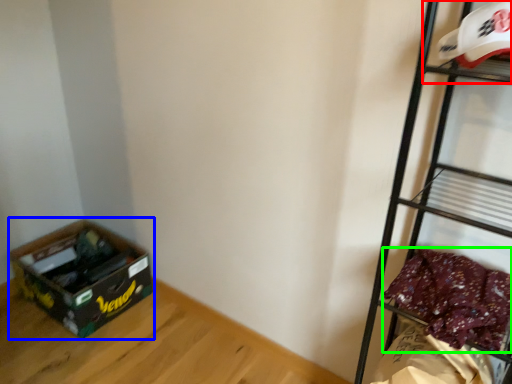
Question: Which object is the closest to the shelf (highlighted by a red box)? Choose among these: storage box (highlighted by a blue box) or clothing (highlighted by a green box).

Choices:
 (A) storage box
 (B) clothing

Answer: (B)